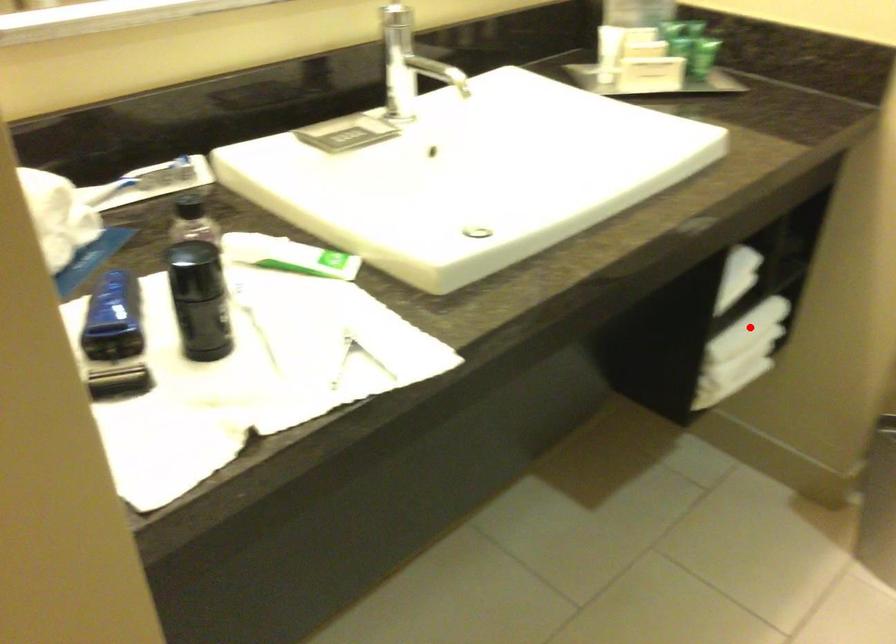
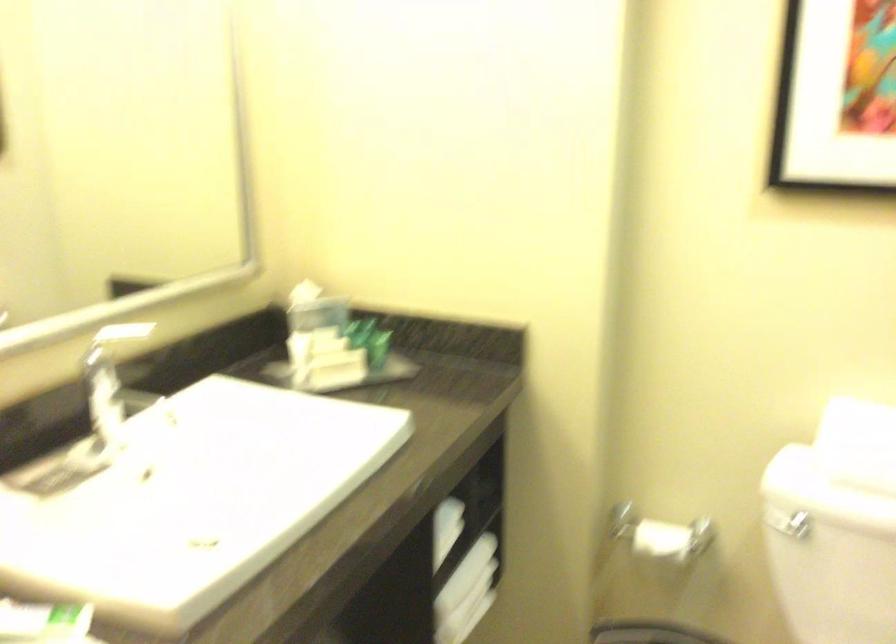
Question: A red point is marked in image1. In image2, is the corresponding 3D point closer to the camera or farther? Reply with the corresponding letter.

Choices:
 (A) The corresponding 3D point is closer.
 (B) The corresponding 3D point is farther.

Answer: (B)